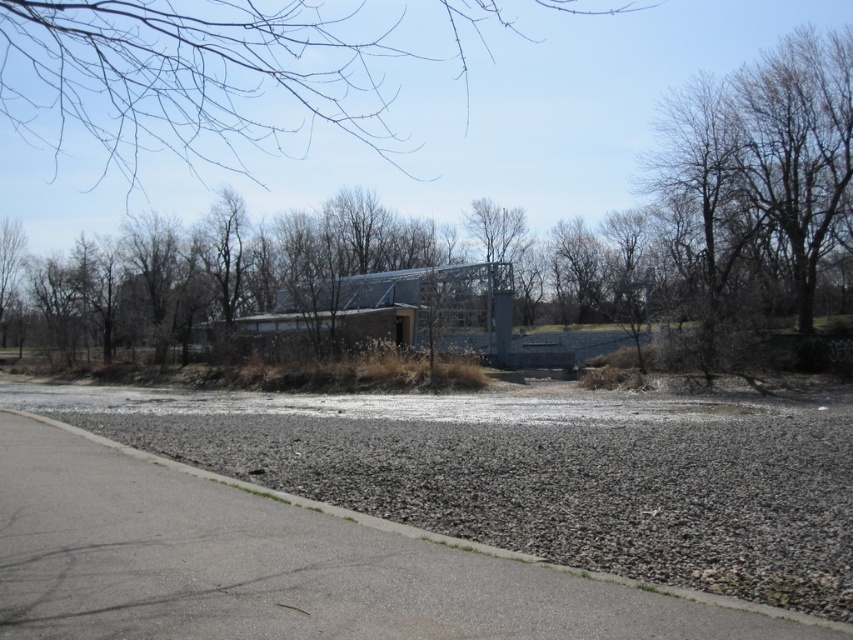
Who is shorter, brown leafless tree at center or gray gravel at lower right?

Standing shorter between the two is gray gravel at lower right.

Is point (173, 337) positioned before point (631, 502)?

That is False.

Does point (524, 314) come closer to viewer compared to point (630, 426)?

That is False.

This screenshot has width=853, height=640. In order to click on brown leafless tree at center in this screenshot , I will do [x=524, y=253].

Is brown leafless tree at center positioned in front of bare branches at upper center?

No, it is behind bare branches at upper center.

Does point (212, 273) come in front of point (231, 115)?

Yes, point (212, 273) is in front of point (231, 115).

Between point (212, 298) and point (202, 134), which one is positioned in front?

Point (212, 298) is more forward.

At what (x,y) coordinates should I click in order to perform the action: click on brown leafless tree at center. Please return your answer as a coordinate pair (x, y). This screenshot has height=640, width=853. Looking at the image, I should click on (524, 253).

Does gray gravel at lower right have a lesser width compared to bare branches at upper center?

Yes, gray gravel at lower right is thinner than bare branches at upper center.

Looking at this image, can you confirm if gray gravel at lower right is shorter than bare branches at upper center?

Yes, gray gravel at lower right is shorter than bare branches at upper center.

Between point (677, 577) and point (184, 61), which one is positioned behind?

Positioned behind is point (184, 61).

At what (x,y) coordinates should I click in order to perform the action: click on gray gravel at lower right. Please return your answer as a coordinate pair (x, y). Looking at the image, I should click on (550, 481).